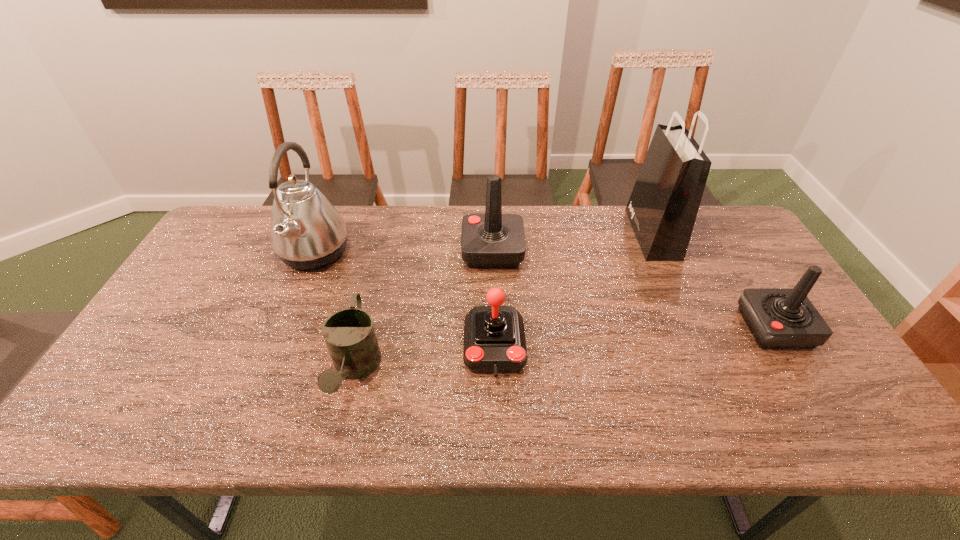
The height and width of the screenshot is (540, 960). I want to click on object situated at the right edge, so click(x=779, y=318).

This screenshot has height=540, width=960. Find the location of `free space at the far edge of the desktop`. free space at the far edge of the desktop is located at coordinates pos(458,242).

In the image, there is a desktop. Find the location of `free space at the near edge`. free space at the near edge is located at coordinates (753, 435).

In the image, there is a desktop. Where is `free space at the right edge`? This screenshot has width=960, height=540. free space at the right edge is located at coordinates (804, 379).

At what (x,y) coordinates should I click in order to perform the action: click on vacant region at the far left corner of the desktop. Please return your answer as a coordinate pair (x, y). Looking at the image, I should click on (239, 206).

The image size is (960, 540). In order to click on vacant space at the far right corner of the desktop in this screenshot , I will do `click(710, 237)`.

You are a GUI agent. You are given a task and a screenshot of the screen. Output one action in this format:
    pyautogui.click(x=<x>, y=<y>)
    Task: Click on the vacant space that is in between the rightmost object and the shopping bag
    
    Given the screenshot: What is the action you would take?
    pyautogui.click(x=713, y=281)

At what (x,y) coordinates should I click in order to perform the action: click on blank region between the kettle and the farthest joystick. Please return your answer as a coordinate pair (x, y). The image size is (960, 540). Looking at the image, I should click on (403, 252).

Where is `unoccupied position between the watering can and the rightmost joystick`? This screenshot has height=540, width=960. unoccupied position between the watering can and the rightmost joystick is located at coordinates (565, 349).

At what (x,y) coordinates should I click in order to perform the action: click on free area in between the fifth object from left to right and the shortest joystick. Please return your answer as a coordinate pair (x, y). This screenshot has height=540, width=960. Looking at the image, I should click on (573, 291).